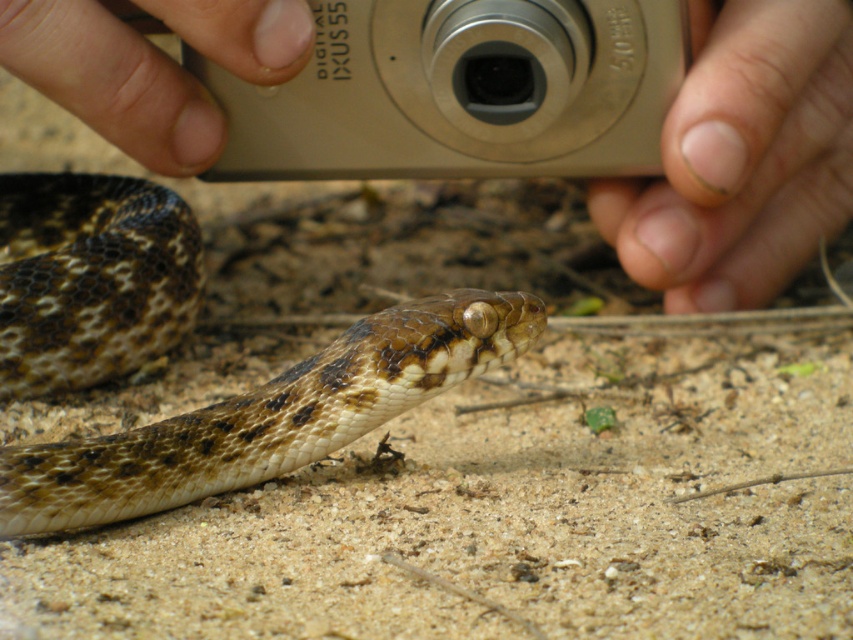
Question: Among these objects, which one is farthest from the camera?

Choices:
 (A) nail polish on fingernail at upper right
 (B) flesh-toned skin at upper left
 (C) silver metallic camera at upper center

Answer: (A)

Question: Can you confirm if brown scaly snake at center is wider than silver metallic camera at upper center?

Choices:
 (A) no
 (B) yes

Answer: (A)

Question: Among these objects, which one is farthest from the camera?

Choices:
 (A) flesh-toned skin at upper left
 (B) brown scaly snake at center

Answer: (B)

Question: Can you confirm if silver metallic camera at upper center is smaller than nail polish on fingernail at upper right?

Choices:
 (A) yes
 (B) no

Answer: (A)

Question: Estimate the real-world distances between objects in this image. Which object is closer to the brown scaly snake at center?

Choices:
 (A) silver metallic camera at upper center
 (B) flesh-toned skin at upper left

Answer: (B)

Question: Is brown scaly snake at center positioned at the back of nail polish on fingernail at upper right?

Choices:
 (A) yes
 (B) no

Answer: (B)